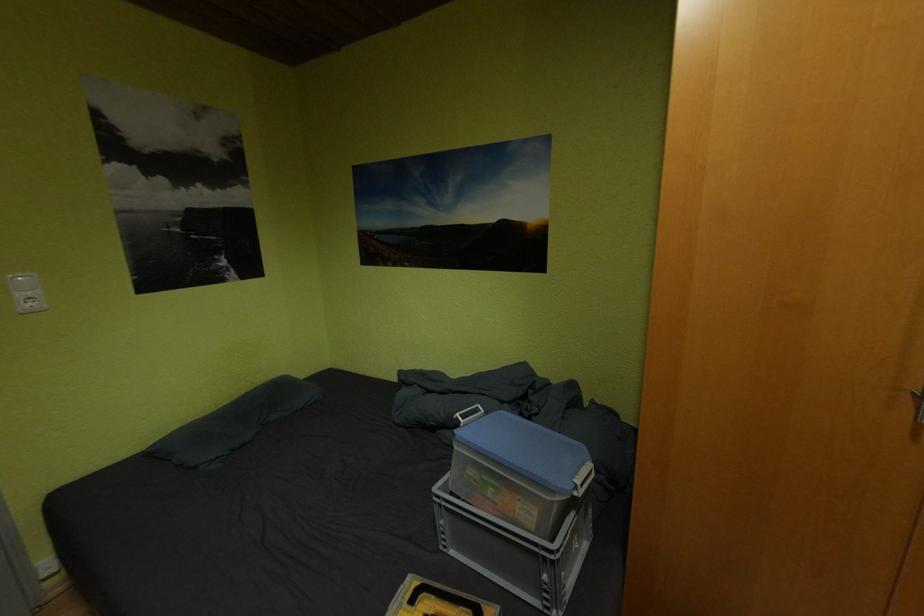
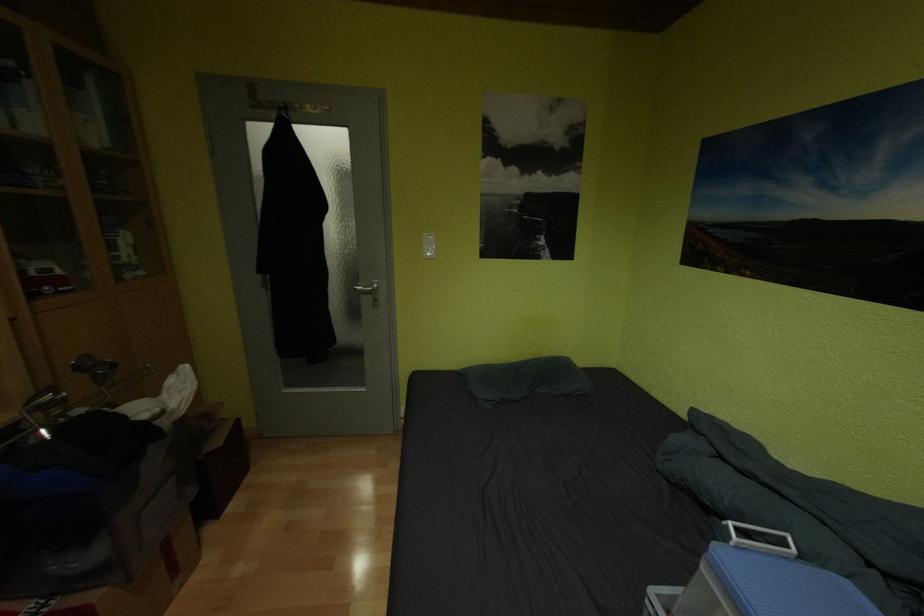
Question: How did the camera likely rotate?

Choices:
 (A) Left
 (B) Right
 (C) Up
 (D) Down

Answer: (A)